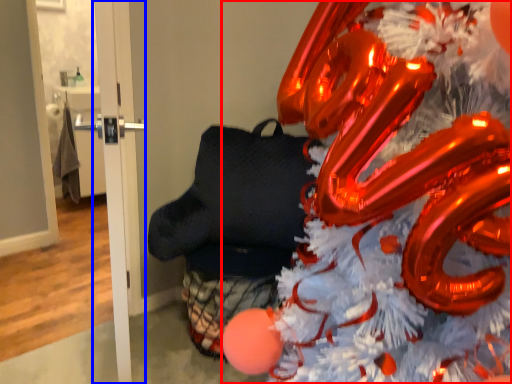
Question: Among these objects, which one is nearest to the camera, christmas tree (highlighted by a red box) or door (highlighted by a blue box)?

Choices:
 (A) christmas tree
 (B) door

Answer: (A)